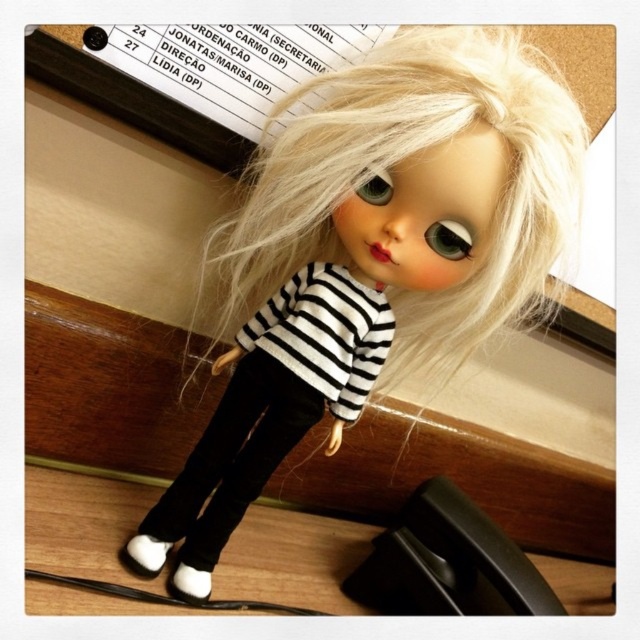
Which is behind, point (291, 193) or point (132, 564)?

The point (132, 564) is behind.

Which is behind, point (486, 300) or point (163, 548)?

The point (163, 548) is behind.

The image size is (640, 640). In order to click on matte black doll at center in this screenshot , I will do `click(376, 250)`.

Does point (152, 544) come farther from viewer compared to point (182, 596)?

Yes, it is behind point (182, 596).

What do you see at coordinates (145, 554) in the screenshot? I see `white matte shoe at lower left` at bounding box center [145, 554].

Locate an element on the screen. This screenshot has width=640, height=640. white matte shoe at lower left is located at coordinates (145, 554).

Is matte black doll at center above white matte shoe at lower center?

Yes.

Does point (529, 218) come in front of point (202, 579)?

Yes, point (529, 218) is in front of point (202, 579).

The height and width of the screenshot is (640, 640). I want to click on matte black doll at center, so click(x=376, y=250).